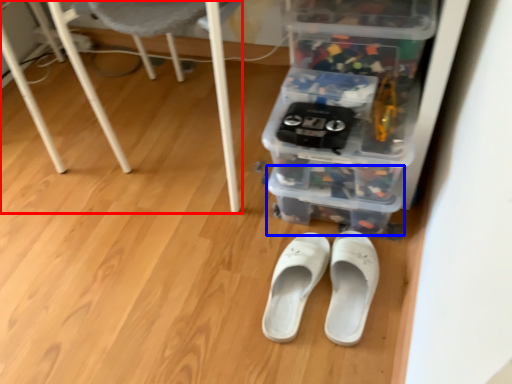
Question: Which object is further to the camera taking this photo, furniture (highlighted by a red box) or storage box (highlighted by a blue box)?

Choices:
 (A) furniture
 (B) storage box

Answer: (B)